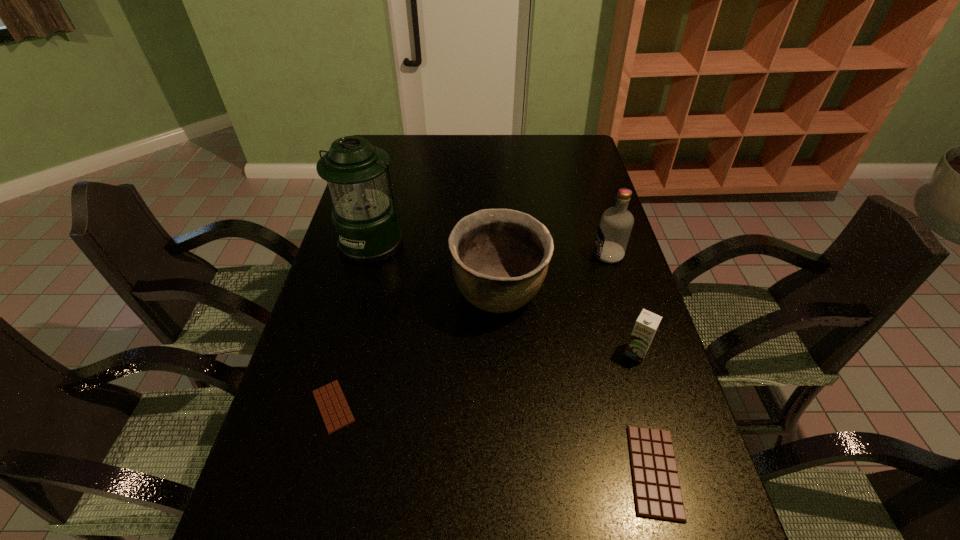
Identify the location of the left candy bar. The width and height of the screenshot is (960, 540). pos(334,409).

You are a GUI agent. You are given a task and a screenshot of the screen. Output one action in this format:
    pyautogui.click(x=<x>, y=<y>)
    Task: Click on the shorter candy bar
    
    Given the screenshot: What is the action you would take?
    pyautogui.click(x=334, y=409)

Locate an element on the screen. The height and width of the screenshot is (540, 960). the second shortest object is located at coordinates (657, 492).

Locate an element on the screen. The image size is (960, 540). the right candy bar is located at coordinates (657, 492).

The height and width of the screenshot is (540, 960). In order to click on the third object from left to right in this screenshot , I will do `click(500, 257)`.

The width and height of the screenshot is (960, 540). Find the location of `lantern`. lantern is located at coordinates (365, 219).

This screenshot has height=540, width=960. Identify the location of the fourth tallest object. (646, 325).

Where is `chocolate milk`? Image resolution: width=960 pixels, height=540 pixels. chocolate milk is located at coordinates (646, 325).

Where is `vodka`? This screenshot has width=960, height=540. vodka is located at coordinates (615, 227).

I want to click on blank space located on the right of the left candy bar, so click(460, 407).